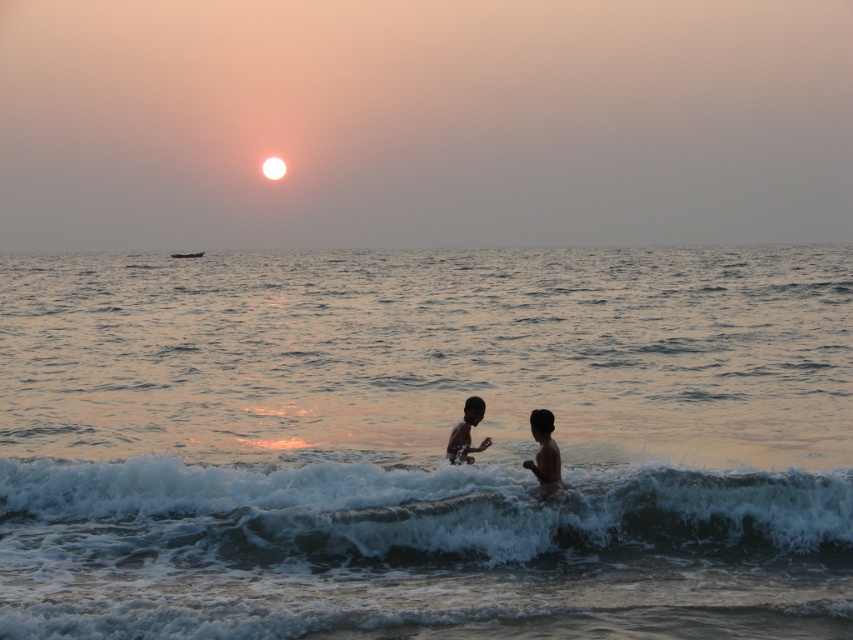
In the scene shown: You are a photographer trying to capture the sunset reflection on the water. You notice two elements in the scene described as translucent water at wave center and white foam surf at upper center. Which of these elements is positioned to the right of the other?

The translucent water at wave center is positioned to the right of the white foam surf at upper center.

You are a parent watching your child playing in the water at the beach. You notice a point marked at coordinates (544, 452). What is located at that point?

At point (544, 452) lies the smooth skin child at center.